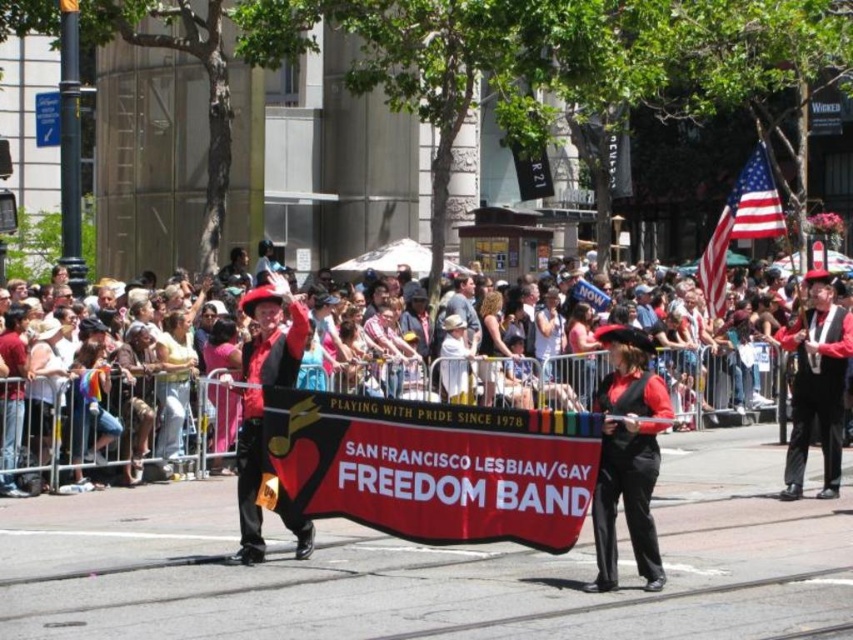
Question: Is matte black banner at center thinner than shiny black vest at center?

Choices:
 (A) no
 (B) yes

Answer: (A)

Question: Does shiny black vest at center appear over american flag at upper right?

Choices:
 (A) no
 (B) yes

Answer: (A)

Question: Which object appears closest to the camera in this image?

Choices:
 (A) red fabric banner at center
 (B) american flag at upper right

Answer: (A)

Question: Which of these objects is positioned closest to the matte red hat at center?

Choices:
 (A) matte black banner at center
 (B) red fabric banner at center

Answer: (B)

Question: Is red fabric banner at center wider than shiny black vest at center?

Choices:
 (A) yes
 (B) no

Answer: (A)

Question: Which point is closer to the camera?

Choices:
 (A) (648, 340)
 (B) (767, 192)
 (C) (751, 381)
 (D) (798, 353)

Answer: (A)